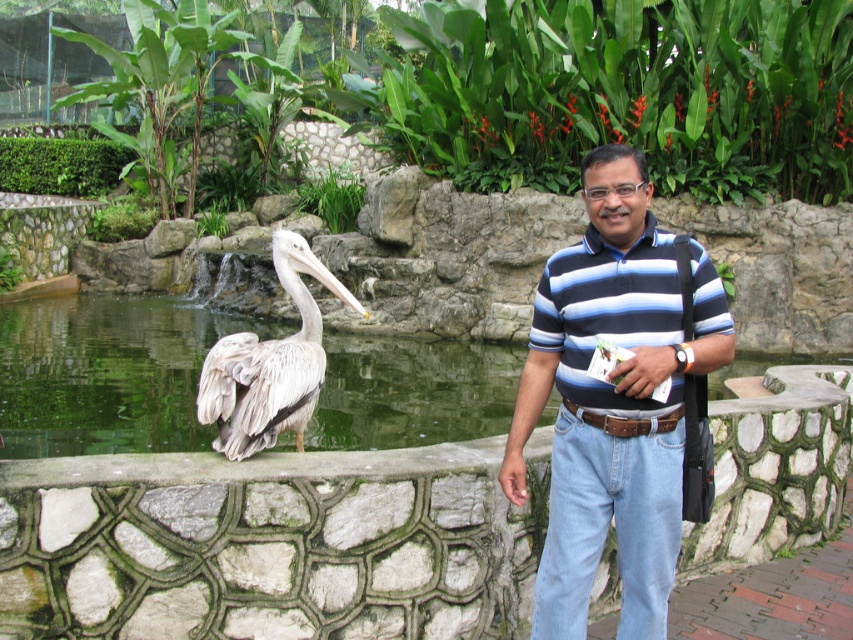
You are a fashion designer observing two men in the scene. The first man wears a blue striped polo shirt at center, and the second man wears a blue striped polo shirt at right. Which man is wearing a larger sized shirt?

The blue striped polo shirt at center is larger in size than the blue striped polo shirt at right, so the first man is wearing a larger sized shirt.

You are a photographer trying to capture a clear photo of the white feathered pelican at center. However, the blue striped polo shirt at center is blocking your view. Can you move the man to the side so that the pelican is no longer behind the shirt?

The blue striped polo shirt at center is in front of the white feathered pelican at center, so moving the man to the side would allow the pelican to be visible without obstruction.

You are a photographer trying to capture both the blue striped polo shirt at center and the white feathered pelican at center in the same frame. Based on their heights, which one should you focus on first to ensure both are in the shot?

The blue striped polo shirt at center is taller than the white feathered pelican at center, so you should focus on the blue striped polo shirt at center first to ensure both are in the shot.